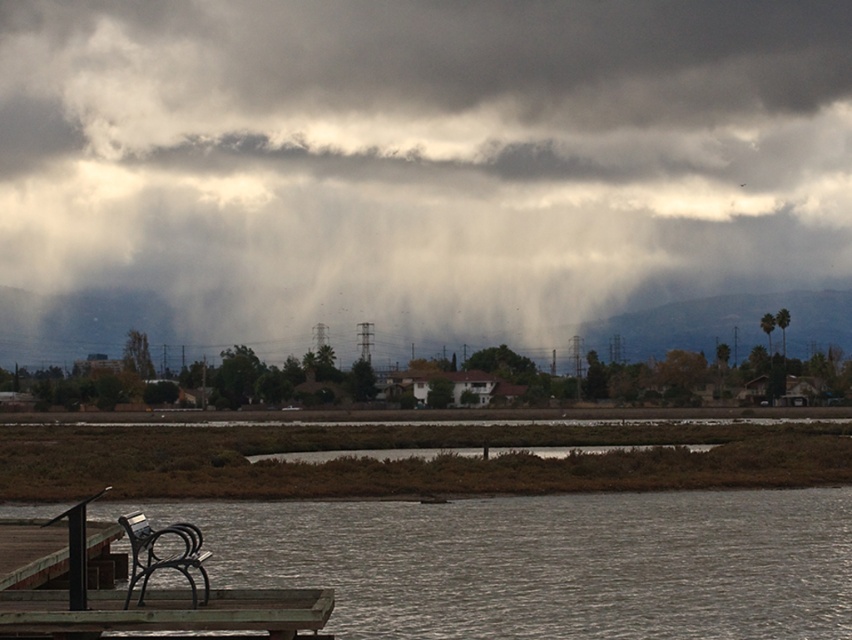
Based on the photo, you are standing at the center of the image and want to walk towards the brown wooden picnic table at lower left. Which direction should you turn to face the grayish water at lower left first before proceeding?

The grayish water at lower left is to the right of the brown wooden picnic table at lower left. To reach the picnic table, you should turn left to face the direction of the grayish water first, then proceed towards it, as the water is positioned to the right side of the picnic table from your central viewpoint.

You are standing in the scene and want to walk from point A to point B. Point A is at coordinates point (417,93) and point B is at coordinates point (134,621). Which point is closer to you when you start your journey?

Point A at coordinates point (417,93) is closer to you because it is further to the viewer than point B at coordinates point (134,621), so you will reach it first.

Consider the image. You are standing in a park and see the dark gray cloud at upper center and the metallic park bench at lower left. Which object is higher in the sky?

The dark gray cloud at upper center is higher in the sky than the metallic park bench at lower left because it is positioned above it.